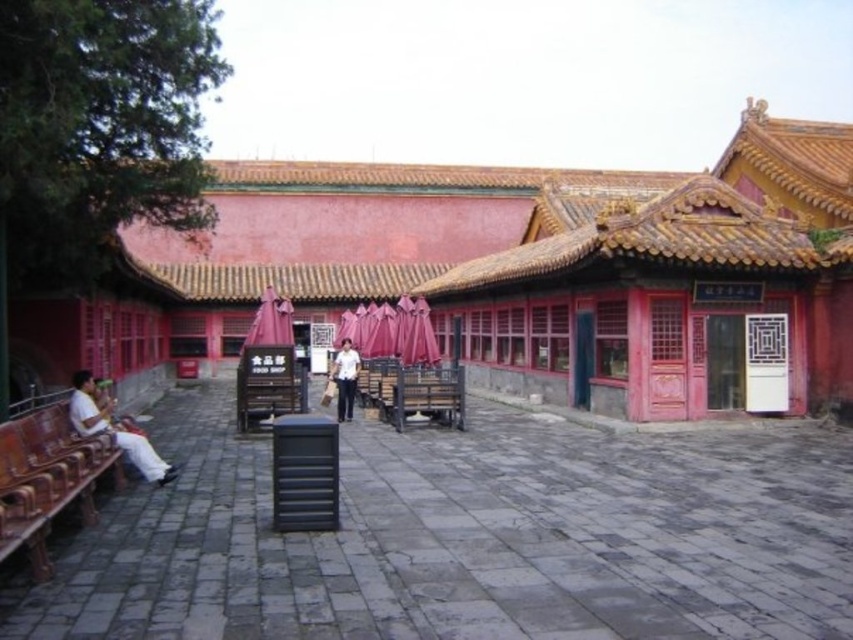
You are a visitor in this courtyard and want to sit down on the wooden bench at center. Where should you walk to from the white cotton shirt at left?

The wooden bench at center is positioned on the right side of white cotton shirt at left, so you should walk to the right side of the white cotton shirt at left to reach the wooden bench at center.

You are a visitor in this courtyard and want to find the taller person. Which one should you look at between the white cotton shirt at left and the white matte shirt at center?

The white matte shirt at center is taller than the white cotton shirt at left, so you should look at the white matte shirt at center.

You are standing at the entrance of the courtyard and want to sit on the wooden bench at center. Which direction should you walk to reach it?

The wooden bench at center is located at point [413,392], so you should walk forward and to the right from the entrance to reach it.